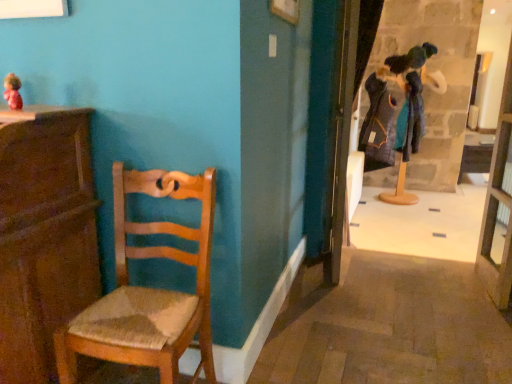
Measure the distance between point (13, 93) and camera.

A distance of 5.00 feet exists between point (13, 93) and camera.

What do you see at coordinates (499, 204) in the screenshot? The height and width of the screenshot is (384, 512). I see `transparent glass door at right` at bounding box center [499, 204].

The height and width of the screenshot is (384, 512). In order to click on transparent glass door at right in this screenshot , I will do 499,204.

In order to click on woven wood chair at left in this screenshot , I will do `click(148, 288)`.

This screenshot has height=384, width=512. What do you see at coordinates (148, 288) in the screenshot? I see `woven wood chair at left` at bounding box center [148, 288].

Find the location of `matte pink doll at upper left`. matte pink doll at upper left is located at coordinates (13, 92).

Could you tell me if matte pink doll at upper left is facing woven wood chair at left?

No, matte pink doll at upper left is not oriented towards woven wood chair at left.

In the scene shown: From a real-world perspective, is matte pink doll at upper left located beneath woven wood chair at left?

No, from a real-world perspective, matte pink doll at upper left is not beneath woven wood chair at left.

Considering the positions of point (6, 89) and point (111, 353), is point (6, 89) closer or farther from the camera than point (111, 353)?

Clearly, point (6, 89) is more distant from the camera than point (111, 353).

Which is more to the left, matte pink doll at upper left or woven wood chair at left?

From the viewer's perspective, matte pink doll at upper left appears more on the left side.

From a real-world perspective, who is located lower, transparent glass door at right or woven wood chair at left?

From a 3D spatial view, woven wood chair at left is below.

Is the position of transparent glass door at right less distant than that of woven wood chair at left?

No.

Is transparent glass door at right smaller than woven wood chair at left?

Correct, transparent glass door at right occupies less space than woven wood chair at left.

From the image's perspective, is transparent glass door at right on top of woven wood chair at left?

Yes, from the image's perspective, transparent glass door at right is above woven wood chair at left.

Consider the image. Which of these two, woven wood chair at left or wooden door at center, is smaller?

Smaller between the two is wooden door at center.

Which of these two, woven wood chair at left or wooden door at center, is thinner?

wooden door at center.

Would you consider woven wood chair at left to be distant from wooden door at center?

woven wood chair at left is far away from wooden door at center.

The height and width of the screenshot is (384, 512). What are the coordinates of `glass door positioned vertically above the woven wood chair at left (from a real-world perspective)` in the screenshot? It's located at (499, 204).

From a real-world perspective, is woven wood chair at left positioned under transparent glass door at right based on gravity?

Yes, from a real-world perspective, woven wood chair at left is beneath transparent glass door at right.

Is point (175, 307) closer to viewer compared to point (510, 141)?

That is True.

Which of these two, woven wood chair at left or transparent glass door at right, is thinner?

transparent glass door at right.

Based on the photo, in the image, is wooden cabinet at left positioned in front of or behind wooden door at center?

wooden cabinet at left is in front of wooden door at center.

Between wooden cabinet at left and wooden door at center, which one appears on the left side from the viewer's perspective?

Positioned to the left is wooden cabinet at left.

Which of these two, wooden cabinet at left or wooden door at center, is thinner?

wooden door at center is thinner.

Between wooden cabinet at left and wooden door at center, which one has larger size?

Bigger between the two is wooden cabinet at left.

Considering the sizes of objects wooden cabinet at left and woven wood chair at left in the image provided, who is wider, wooden cabinet at left or woven wood chair at left?

With larger width is wooden cabinet at left.

From a real-world perspective, is wooden cabinet at left physically located above or below woven wood chair at left?

In terms of real-world spatial position, wooden cabinet at left is above woven wood chair at left.

Is there a large distance between wooden cabinet at left and woven wood chair at left?

No, wooden cabinet at left is not far from woven wood chair at left.

Between wooden cabinet at left and woven wood chair at left, which one has smaller size?

woven wood chair at left is smaller.

Considering the positions of point (82, 175) and point (504, 290), is point (82, 175) closer or farther from the camera than point (504, 290)?

Point (82, 175) is positioned closer to the camera compared to point (504, 290).

Consider the image. Is wooden cabinet at left not inside transparent glass door at right?

That's correct, wooden cabinet at left is outside of transparent glass door at right.

Is wooden cabinet at left positioned with its back to transparent glass door at right?

wooden cabinet at left is not turned away from transparent glass door at right.

Locate an element on the screen. The height and width of the screenshot is (384, 512). toy above the woven wood chair at left (from a real-world perspective) is located at coordinates (13, 92).

This screenshot has width=512, height=384. What are the coordinates of `chair on the left of transparent glass door at right` in the screenshot? It's located at (148, 288).

When comparing their distances from matte pink doll at upper left, does wooden cabinet at left or transparent glass door at right seem closer?

The object closer to matte pink doll at upper left is wooden cabinet at left.

From the image, which object appears to be farther from matte pink doll at upper left, wooden cabinet at left or woven wood chair at left?

The object further to matte pink doll at upper left is woven wood chair at left.

Based on their spatial positions, is matte pink doll at upper left or wooden cabinet at left closer to woven wood chair at left?

wooden cabinet at left.

Looking at this image, based on their spatial positions, is wooden cabinet at left or matte pink doll at upper left further from woven wood chair at left?

matte pink doll at upper left.

From the image, which object appears to be nearer to transparent glass door at right, wooden cabinet at left or woven wood chair at left?

Among the two, woven wood chair at left is located nearer to transparent glass door at right.

When comparing their distances from wooden door at center, does transparent glass door at right or matte pink doll at upper left seem closer?

transparent glass door at right.

From the image, which object appears to be nearer to wooden door at center, matte pink doll at upper left or wooden cabinet at left?

Based on the image, wooden cabinet at left appears to be nearer to wooden door at center.

From the picture: Which object lies further to the anchor point matte pink doll at upper left, wooden door at center or wooden cabinet at left?

The object further to matte pink doll at upper left is wooden door at center.

Where is `cabinetry between matte pink doll at upper left and woven wood chair at left vertically`? The width and height of the screenshot is (512, 384). cabinetry between matte pink doll at upper left and woven wood chair at left vertically is located at coordinates (44, 235).

Where is `chair situated between matte pink doll at upper left and wooden door at center from left to right`? The height and width of the screenshot is (384, 512). chair situated between matte pink doll at upper left and wooden door at center from left to right is located at coordinates (148, 288).

Locate an element on the screen. The width and height of the screenshot is (512, 384). door situated between woven wood chair at left and transparent glass door at right from left to right is located at coordinates (340, 134).

This screenshot has height=384, width=512. I want to click on door between wooden cabinet at left and transparent glass door at right from left to right, so click(x=340, y=134).